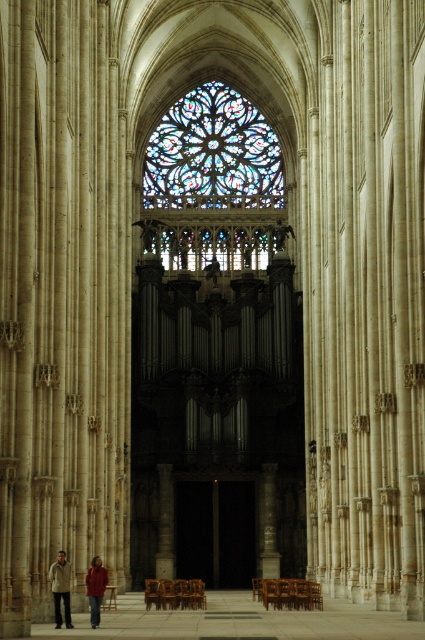
You are standing in the cathedral and see the stained glass at upper center and the khaki cotton shirt at lower left. Which object is positioned to the right of the other?

The stained glass at upper center is positioned to the right of the khaki cotton shirt at lower left.

You are a photographer trying to capture the entire stained glass at upper center and khaki cotton shirt at lower left in a single frame. Based on their sizes, will you need to adjust your camera angle to include both?

The stained glass at upper center might be wider than khaki cotton shirt at lower left, so you may need to adjust your camera angle to ensure both fit in the frame.